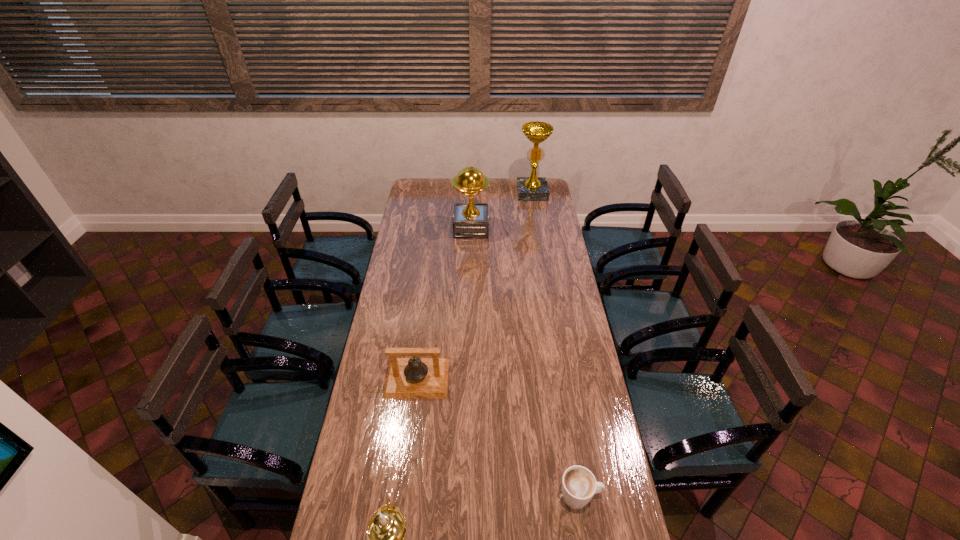
At what (x,y) coordinates should I click in order to perform the action: click on free space at the far right corner of the desktop. Please return your answer as a coordinate pair (x, y). This screenshot has height=540, width=960. Looking at the image, I should click on (549, 190).

Find the location of `vacant space that's between the cappuccino and the left award`. vacant space that's between the cappuccino and the left award is located at coordinates (525, 362).

Identify the location of vacant space that is in between the bell and the cappuccino. (498, 437).

At what (x,y) coordinates should I click in order to perform the action: click on free spot between the farther award and the shortest object. Please return your answer as a coordinate pair (x, y). Looking at the image, I should click on coord(556,345).

Locate an element on the screen. This screenshot has height=540, width=960. free spot between the third farthest object and the farthest object is located at coordinates coord(474,286).

The image size is (960, 540). What are the coordinates of `free space between the farther award and the third farthest object` in the screenshot? It's located at (474, 286).

Where is `vacant area between the cappuccino and the bell`? The image size is (960, 540). vacant area between the cappuccino and the bell is located at coordinates (498, 437).

Find the location of `object identified as the third closest to the candle holder`. object identified as the third closest to the candle holder is located at coordinates (470, 220).

Where is `object that can be found as the closest to the right award`? object that can be found as the closest to the right award is located at coordinates (470, 220).